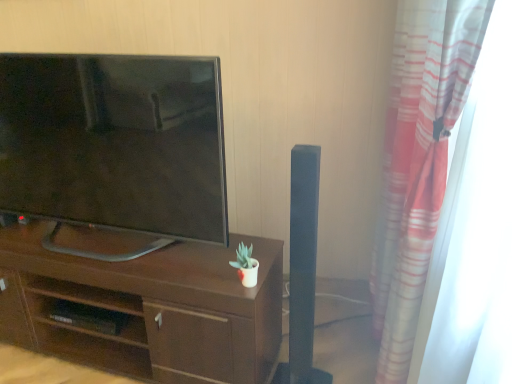
Question: Should I look upward or downward to see matte black tv at left?

Choices:
 (A) up
 (B) down

Answer: (A)

Question: Does matte black tv at left have a lesser width compared to dark wood desk at center?

Choices:
 (A) no
 (B) yes

Answer: (B)

Question: Is matte black tv at left next to dark wood desk at center?

Choices:
 (A) no
 (B) yes

Answer: (A)

Question: Can you confirm if matte black tv at left is taller than dark wood desk at center?

Choices:
 (A) yes
 (B) no

Answer: (A)

Question: Is matte black tv at left looking in the opposite direction of dark wood desk at center?

Choices:
 (A) yes
 (B) no

Answer: (B)

Question: From a real-world perspective, does matte black tv at left sit lower than dark wood desk at center?

Choices:
 (A) yes
 (B) no

Answer: (B)

Question: Is the depth of matte black tv at left greater than that of dark wood desk at center?

Choices:
 (A) yes
 (B) no

Answer: (B)

Question: Is matte black tv at left looking in the opposite direction of striped fabric curtain at right?

Choices:
 (A) yes
 (B) no

Answer: (B)

Question: Considering the relative sizes of matte black tv at left and striped fabric curtain at right in the image provided, is matte black tv at left thinner than striped fabric curtain at right?

Choices:
 (A) yes
 (B) no

Answer: (B)

Question: Is matte black tv at left smaller than striped fabric curtain at right?

Choices:
 (A) yes
 (B) no

Answer: (A)

Question: From a real-world perspective, is matte black tv at left positioned under striped fabric curtain at right based on gravity?

Choices:
 (A) no
 (B) yes

Answer: (A)

Question: Considering the relative positions of matte black tv at left and striped fabric curtain at right in the image provided, is matte black tv at left to the left of striped fabric curtain at right from the viewer's perspective?

Choices:
 (A) no
 (B) yes

Answer: (B)

Question: Does matte black tv at left have a greater width compared to striped fabric curtain at right?

Choices:
 (A) no
 (B) yes

Answer: (B)

Question: Does striped fabric curtain at right contain matte black tv at left?

Choices:
 (A) yes
 (B) no

Answer: (B)